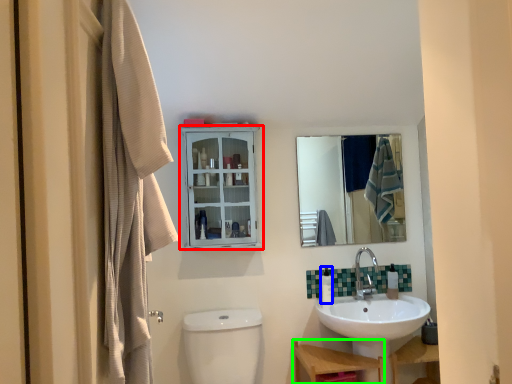
Question: Which object is positioned farthest from cabinetry (highlighted by a red box)? Select from toiletry (highlighted by a blue box) and furniture (highlighted by a green box).

Choices:
 (A) toiletry
 (B) furniture

Answer: (B)